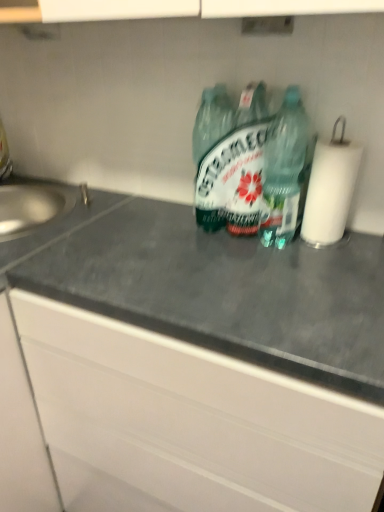
Identify the location of vacant area that is in front of green glass bottle at center, which is the second bottle in right-to-left order. (241, 258).